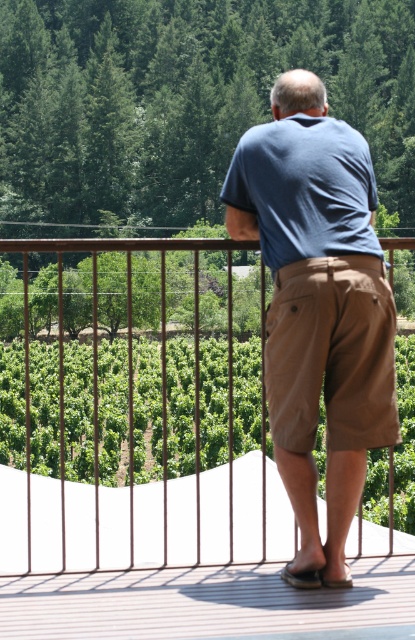
Question: Can you confirm if brown wood balcony at center is thinner than khaki cotton shorts at center?

Choices:
 (A) yes
 (B) no

Answer: (B)

Question: Which object is the closest to the brown wood balcony at center?

Choices:
 (A) brown textured deck at center
 (B) blue cotton shirt at center

Answer: (A)

Question: Is brown wood balcony at center smaller than blue cotton shirt at center?

Choices:
 (A) yes
 (B) no

Answer: (B)

Question: In this image, where is brown textured deck at center located relative to khaki cotton shorts at center?

Choices:
 (A) above
 (B) below

Answer: (B)

Question: Which point is farther to the camera?

Choices:
 (A) (24, 630)
 (B) (268, 358)

Answer: (B)

Question: Which of the following is the farthest from the observer?

Choices:
 (A) (129, 401)
 (B) (366, 280)

Answer: (A)